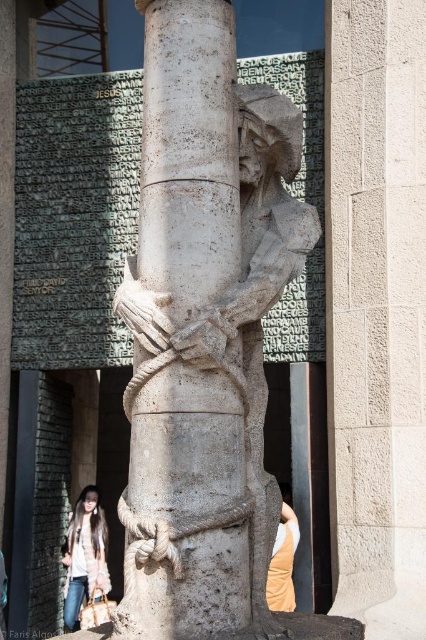
Question: Does white stone column at center appear over light brown fur coat at lower left?

Choices:
 (A) yes
 (B) no

Answer: (A)

Question: Which point appears farthest from the camera in this image?

Choices:
 (A) (66, 545)
 (B) (293, 600)

Answer: (A)

Question: Does white stone column at center come in front of light brown fur coat at lower left?

Choices:
 (A) yes
 (B) no

Answer: (A)

Question: From the image, what is the correct spatial relationship of light brown fur coat at lower left in relation to beige fabric at lower right?

Choices:
 (A) left
 (B) right

Answer: (A)

Question: Which point is closer to the camera?

Choices:
 (A) beige fabric at lower right
 (B) light brown fur coat at lower left

Answer: (A)

Question: Which object is positioned farthest from the light brown fur coat at lower left?

Choices:
 (A) white stone column at center
 (B) beige fabric at lower right

Answer: (A)